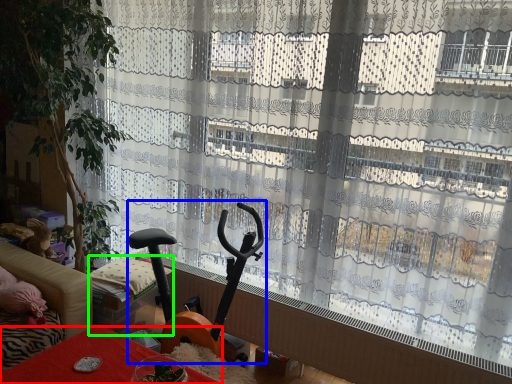
Question: Estimate the real-world distances between objects in this image. Which object is closer to furniture (highlighted by a red box), baby carriage (highlighted by a blue box) or furniture (highlighted by a green box)?

Choices:
 (A) baby carriage
 (B) furniture

Answer: (B)